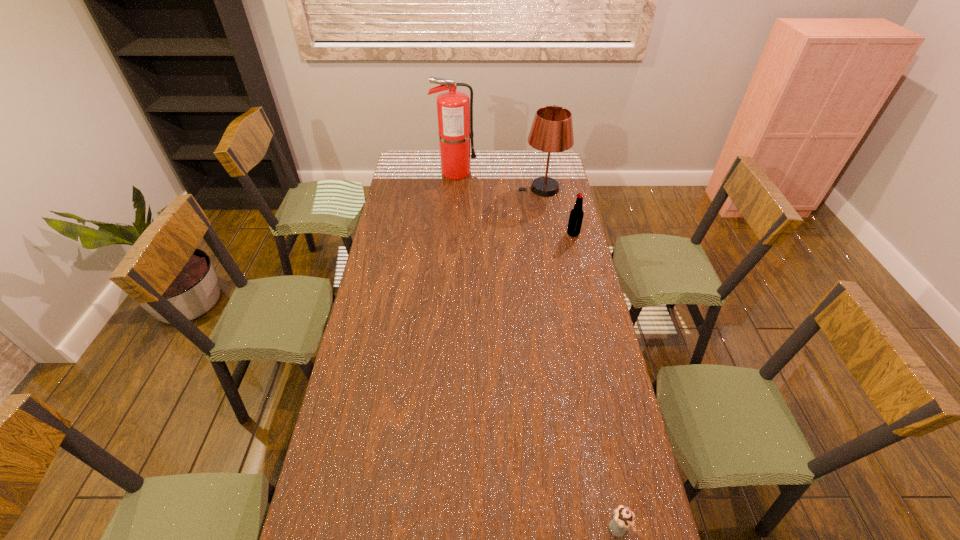
Locate an element on the screen. free space that satisfies the following two spatial constraints: 1. at the nozzle of the beer bottle; 2. on the right side of the leftmost object is located at coordinates (451, 234).

This screenshot has width=960, height=540. What are the coordinates of `vacant region that satisfies the following two spatial constraints: 1. on the back side of the second shortest object; 2. on the front-facing side of the third shortest object` in the screenshot? It's located at (563, 188).